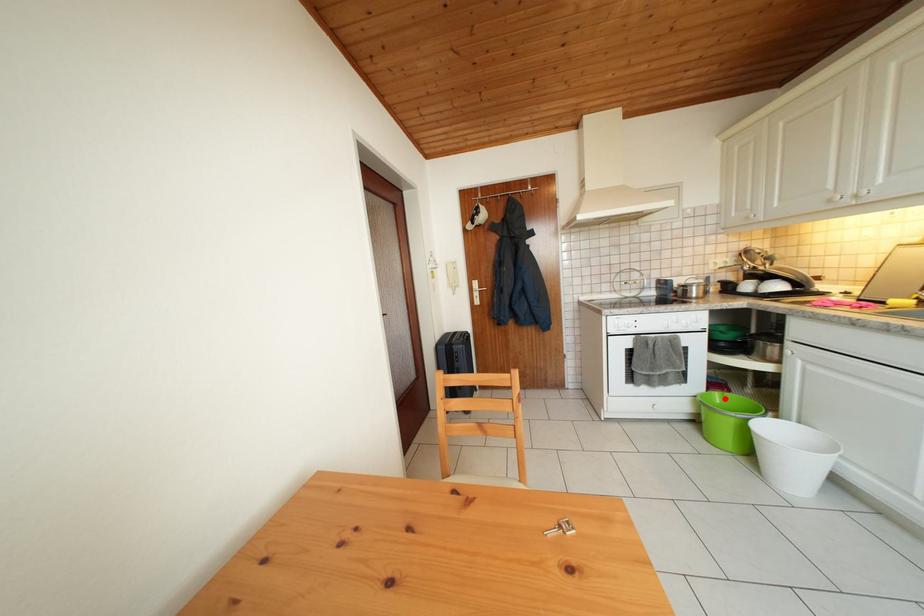
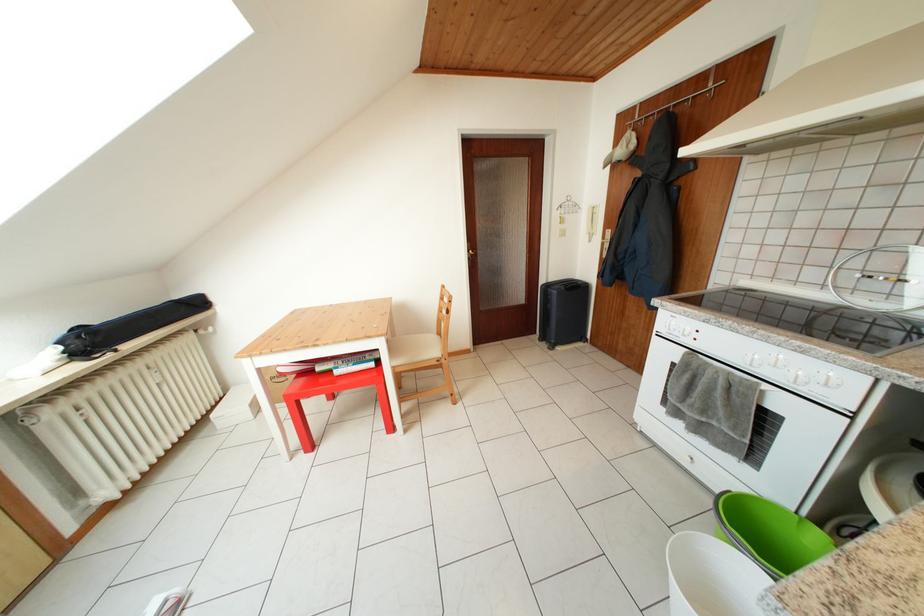
In the second image, find the point that corresponds to the highlighted location in the first image.

(828, 540)